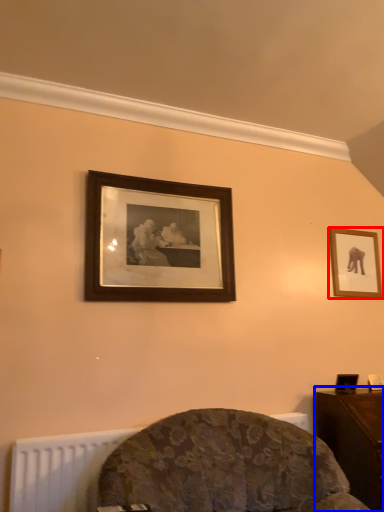
Question: Which point is further to the camera, picture frame (highlighted by a red box) or table (highlighted by a blue box)?

Choices:
 (A) picture frame
 (B) table

Answer: (A)